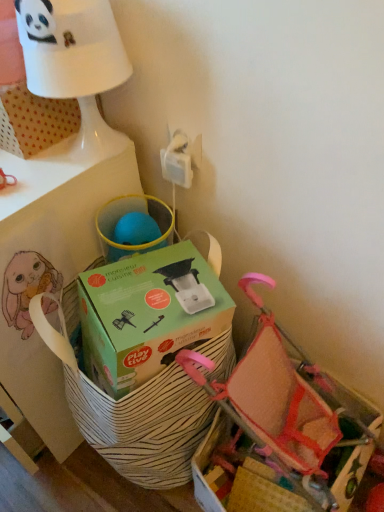
Question: From the image's perspective, is green cardboard box at center above or below pink mesh baby carriage at lower right?

Choices:
 (A) above
 (B) below

Answer: (A)

Question: From a real-world perspective, is green cardboard box at center above or below pink mesh baby carriage at lower right?

Choices:
 (A) above
 (B) below

Answer: (A)

Question: Based on their relative distances, which object is farther from the pink mesh baby carriage at lower right?

Choices:
 (A) green cardboard box at center
 (B) white matte table at upper left
 (C) white glossy table lamp at upper left

Answer: (C)

Question: Which of these objects is positioned closest to the green cardboard box at center?

Choices:
 (A) pink mesh baby carriage at lower right
 (B) white glossy table lamp at upper left
 (C) white matte table at upper left

Answer: (A)